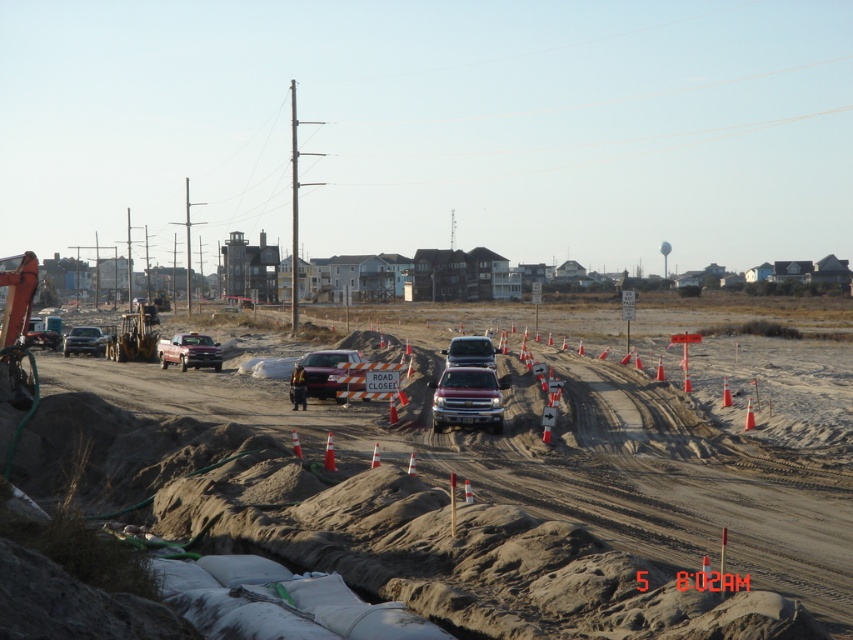
Question: Which of the following is the closest to the observer?

Choices:
 (A) (466, 339)
 (B) (173, 401)
 (C) (195, 356)

Answer: (B)

Question: Is matte orange traffic cones at center smaller than reflective safety vest at center?

Choices:
 (A) no
 (B) yes

Answer: (A)

Question: Which point appears farthest from the camera in this image?

Choices:
 (A) (194, 353)
 (B) (19, 465)

Answer: (A)

Question: Does metallic silver truck at center have a lesser width compared to matte black truck at left?

Choices:
 (A) no
 (B) yes

Answer: (B)

Question: From the image, what is the correct spatial relationship of matte orange traffic cones at center in relation to metallic silver truck at center?

Choices:
 (A) left
 (B) right

Answer: (A)

Question: Which is nearer to the matte orange traffic cones at center?

Choices:
 (A) metallic silver truck at center
 (B) satin silver suv at center
 (C) reflective safety vest at center
 (D) matte black truck at center

Answer: (A)